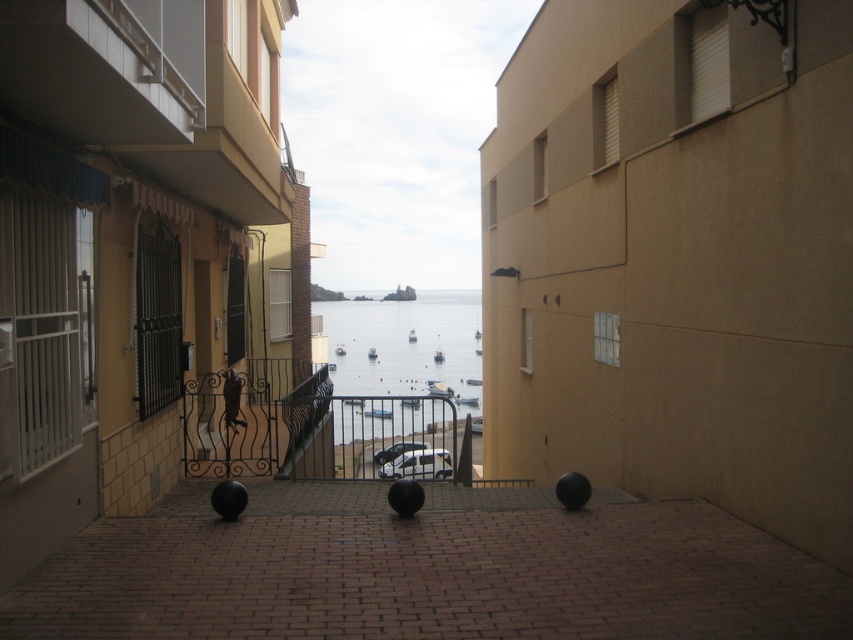
Question: Can you confirm if wrought iron balustrade at center is positioned to the right of metallic gray railing at center?

Choices:
 (A) yes
 (B) no

Answer: (B)

Question: Does brown brick alley at center appear on the left side of white textured balcony at upper left?

Choices:
 (A) no
 (B) yes

Answer: (A)

Question: Which of the following is the farthest from the observer?

Choices:
 (A) (343, 332)
 (B) (141, 124)

Answer: (A)

Question: Which point is closer to the camera?

Choices:
 (A) metallic gray railing at center
 (B) white textured balcony at upper left

Answer: (B)

Question: Which of the following is the closest to the observer?

Choices:
 (A) transparent water at center
 (B) brown brick alley at center
 (C) metallic gray railing at center

Answer: (B)

Question: Does white textured balcony at upper left come in front of wrought iron balustrade at center?

Choices:
 (A) no
 (B) yes

Answer: (B)